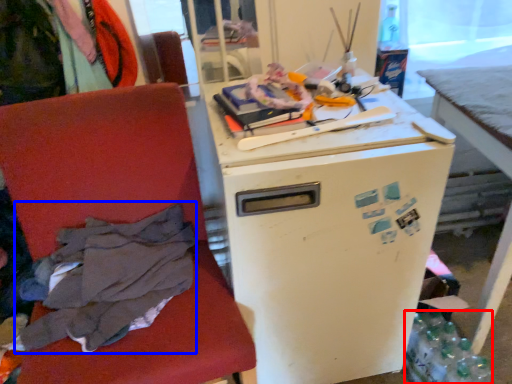
Question: Which object appears farthest to the camera in this image, bottle (highlighted by a red box) or clothing (highlighted by a blue box)?

Choices:
 (A) bottle
 (B) clothing

Answer: (A)